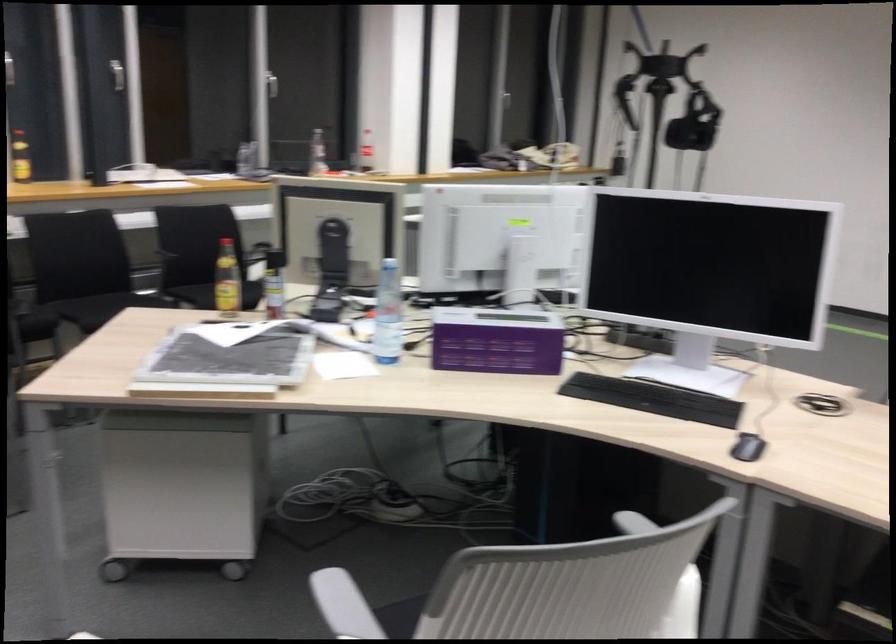
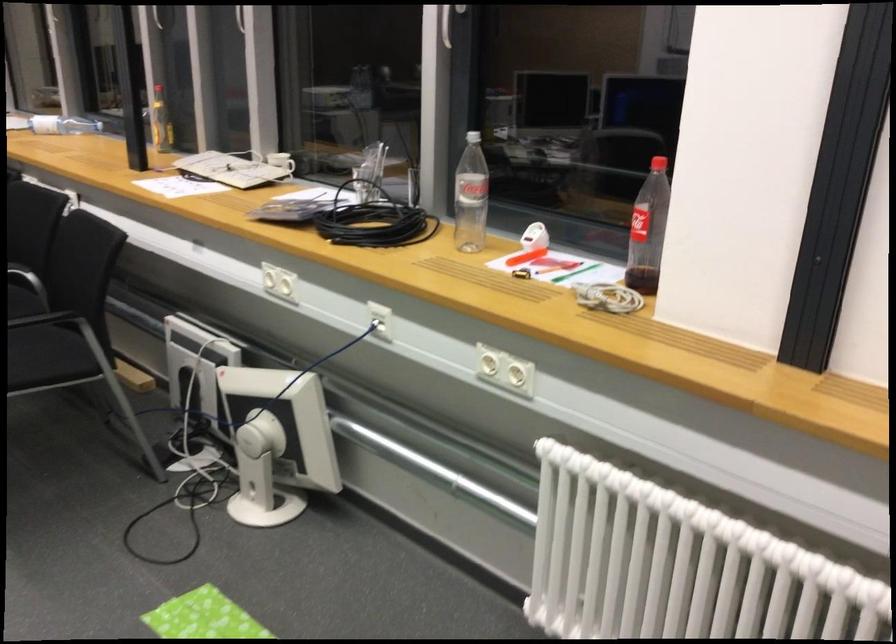
Locate, in the second image, the point that corresponds to pixel 143 172 in the first image.

(280, 162)